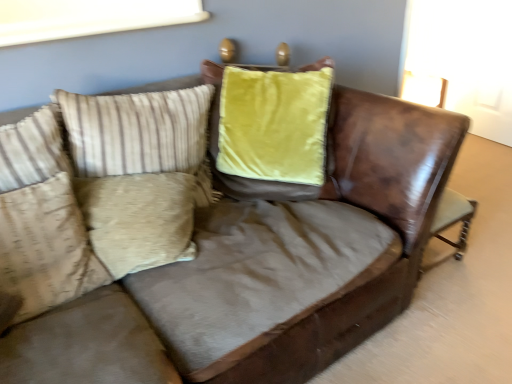
Question: Should I look upward or downward to see beige fabric pillow at left, the second pillow in the top-to-bottom sequence?

Choices:
 (A) down
 (B) up

Answer: (A)

Question: Would you say beige striped pillow at left, the second pillow from the bottom, is outside beige fabric pillow at left, the second pillow in the top-to-bottom sequence?

Choices:
 (A) no
 (B) yes

Answer: (B)

Question: From the image's perspective, is beige striped pillow at left, which appears as the 1th pillow when viewed from the top, located above beige fabric pillow at left, the second pillow in the top-to-bottom sequence?

Choices:
 (A) no
 (B) yes

Answer: (B)

Question: Is beige striped pillow at left, which appears as the 1th pillow when viewed from the top, wider than beige fabric pillow at left, the second pillow in the top-to-bottom sequence?

Choices:
 (A) yes
 (B) no

Answer: (A)

Question: Is beige striped pillow at left, the second pillow from the bottom, to the right of beige fabric pillow at left, the second pillow in the top-to-bottom sequence, from the viewer's perspective?

Choices:
 (A) yes
 (B) no

Answer: (A)

Question: Considering the relative sizes of beige striped pillow at left, which appears as the 1th pillow when viewed from the top, and beige fabric pillow at left, the second pillow in the top-to-bottom sequence, in the image provided, is beige striped pillow at left, which appears as the 1th pillow when viewed from the top, smaller than beige fabric pillow at left, the second pillow in the top-to-bottom sequence,?

Choices:
 (A) no
 (B) yes

Answer: (A)

Question: From a real-world perspective, is beige striped pillow at left, the second pillow from the bottom, located higher than beige fabric pillow at left, the second pillow in the top-to-bottom sequence?

Choices:
 (A) yes
 (B) no

Answer: (A)

Question: Is beige fabric pillow at left, the second pillow in the top-to-bottom sequence, facing away from beige striped pillow at left, which appears as the 1th pillow when viewed from the top?

Choices:
 (A) no
 (B) yes

Answer: (A)

Question: Is beige fabric pillow at left, the second pillow in the top-to-bottom sequence, not inside beige striped pillow at left, the second pillow from the bottom?

Choices:
 (A) yes
 (B) no

Answer: (A)

Question: Could beige striped pillow at left, the second pillow from the bottom, be considered to be inside beige fabric pillow at left, the second pillow in the top-to-bottom sequence?

Choices:
 (A) yes
 (B) no

Answer: (B)

Question: Does beige fabric pillow at left, the second pillow in the top-to-bottom sequence, appear on the right side of beige striped pillow at left, which appears as the 1th pillow when viewed from the top?

Choices:
 (A) yes
 (B) no

Answer: (B)

Question: Is beige fabric pillow at left, the second pillow in the top-to-bottom sequence, oriented towards beige striped pillow at left, which appears as the 1th pillow when viewed from the top?

Choices:
 (A) no
 (B) yes

Answer: (A)

Question: Is beige fabric pillow at left, the second pillow in the top-to-bottom sequence, far away from beige striped pillow at left, the second pillow from the bottom?

Choices:
 (A) yes
 (B) no

Answer: (B)

Question: From their relative heights in the image, would you say beige striped pillow at left, which appears as the 1th pillow when viewed from the top, is taller or shorter than beige fabric pillow at left, the 1th pillow in the bottom-to-top sequence?

Choices:
 (A) short
 (B) tall

Answer: (A)